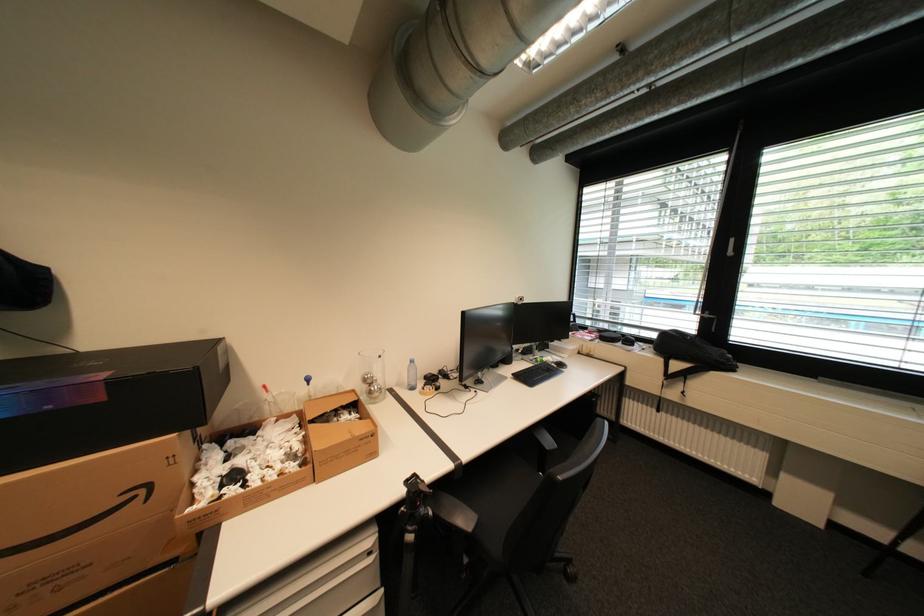
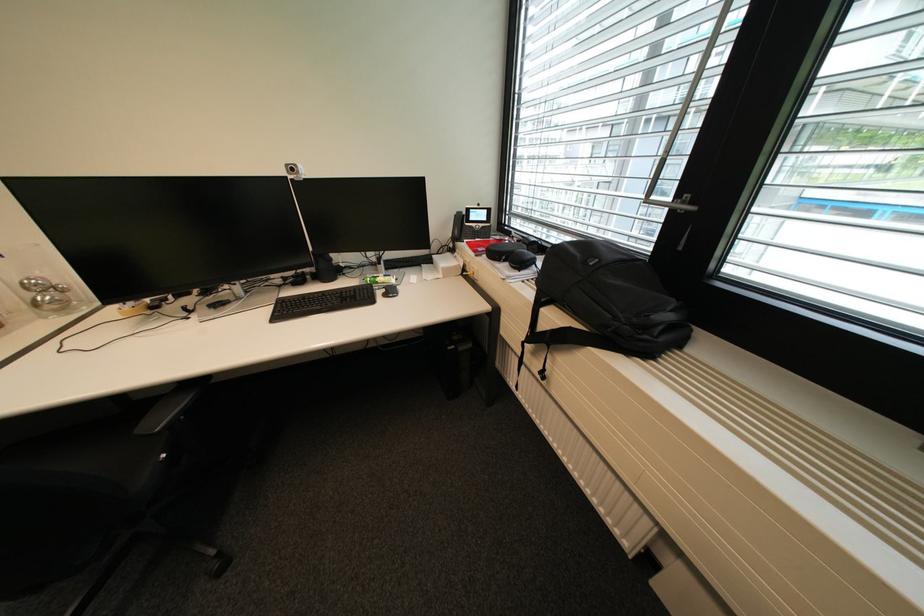
What movement of the cameraman would produce the second image?

The cameraman walked toward right, forward.